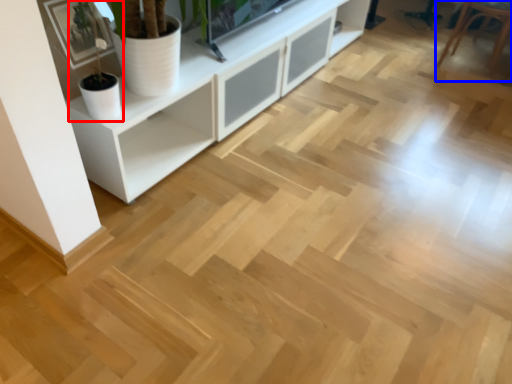
Question: Among these objects, which one is farthest to the camera, houseplant (highlighted by a red box) or armchair (highlighted by a blue box)?

Choices:
 (A) houseplant
 (B) armchair

Answer: (B)